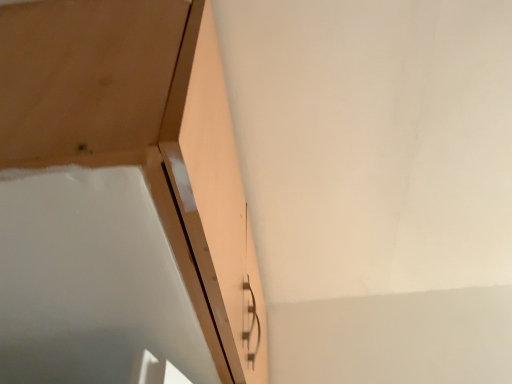
Question: Should I look upward or downward to see matte wood door at upper left?

Choices:
 (A) down
 (B) up

Answer: (A)